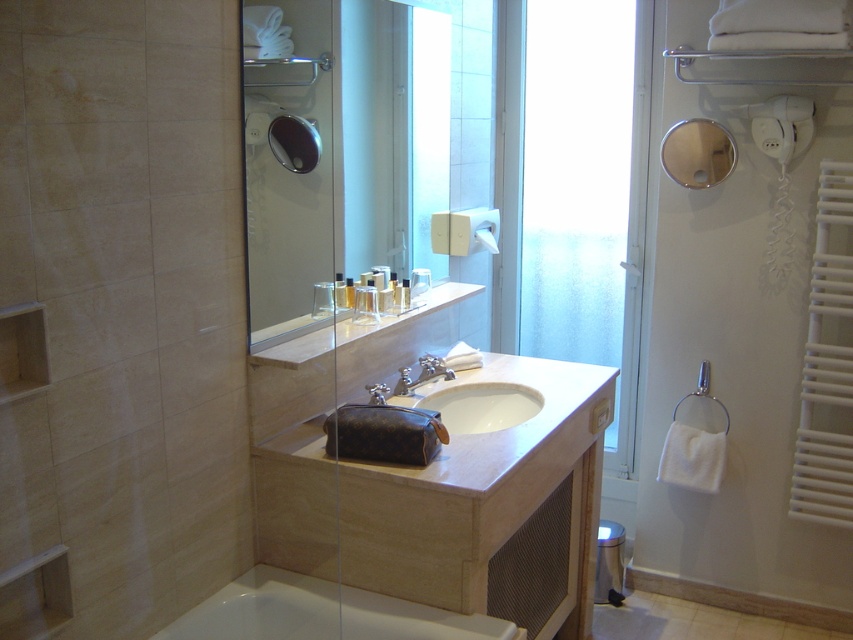
Question: Does frosted glass door at center appear under white glossy sink at center?

Choices:
 (A) no
 (B) yes

Answer: (A)

Question: In this image, where is clear glass mirror at upper center located relative to silver metallic faucet at sink center?

Choices:
 (A) left
 (B) right

Answer: (A)

Question: Which point is closer to the camera?

Choices:
 (A) (490, 248)
 (B) (403, 136)
 (C) (405, 388)
 (D) (548, 134)

Answer: (C)

Question: Which point appears farthest from the camera in this image?

Choices:
 (A) (508, 621)
 (B) (753, 77)
 (C) (404, 380)

Answer: (B)

Question: Is white glossy bathtub at lower left further to camera compared to white glossy sink at center?

Choices:
 (A) no
 (B) yes

Answer: (A)

Question: Which of these objects is positioned closest to the frosted glass door at center?

Choices:
 (A) light beige marble sink at center
 (B) white fabric towel bar at upper center
 (C) silver metallic faucet at sink center
 (D) white glossy sink at center

Answer: (B)